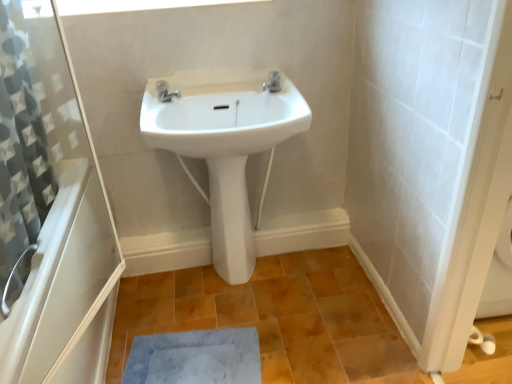
Identify the location of vacant space that is to the left of white glossy bidet at center. (194, 286).